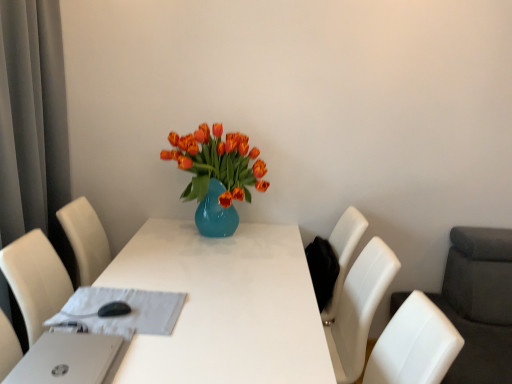
At what (x,y) coordinates should I click in order to perform the action: click on blank space situated above white glossy table at center (from a real-world perspective). Please return your answer as a coordinate pair (x, y). Looking at the image, I should click on (158, 277).